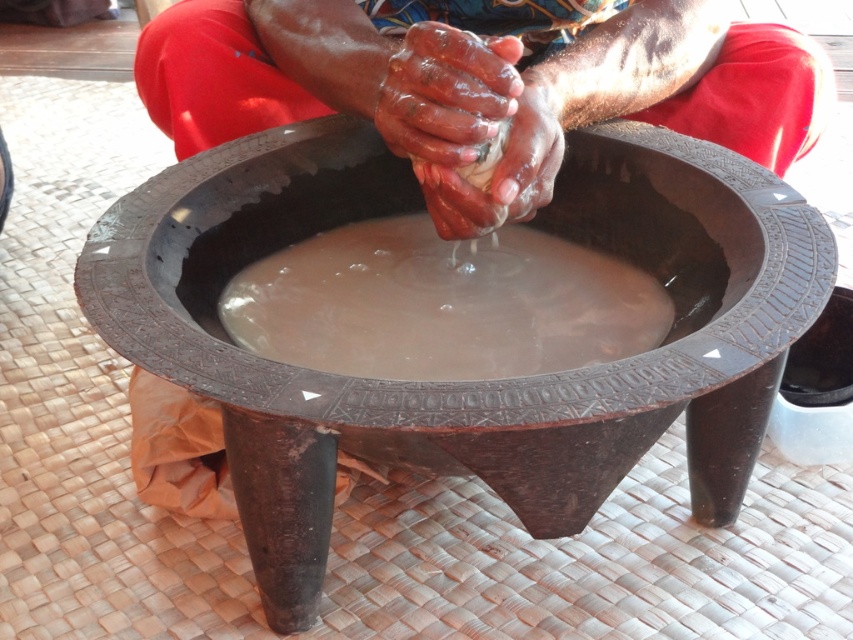
Who is taller, carved wooden bowl at center or smooth clay hands at center?

With more height is carved wooden bowl at center.

Looking at this image, is carved wooden bowl at center taller than smooth clay hands at center?

Yes, carved wooden bowl at center is taller than smooth clay hands at center.

What do you see at coordinates (473, 381) in the screenshot? I see `carved wooden bowl at center` at bounding box center [473, 381].

Where is `carved wooden bowl at center`? This screenshot has width=853, height=640. carved wooden bowl at center is located at coordinates (473, 381).

Does smooth clay hands at center appear on the right side of smooth clay mud at center?

Correct, you'll find smooth clay hands at center to the right of smooth clay mud at center.

Is smooth clay hands at center above smooth clay mud at center?

Indeed, smooth clay hands at center is positioned over smooth clay mud at center.

Locate an element on the screen. The width and height of the screenshot is (853, 640). smooth clay hands at center is located at coordinates (479, 84).

Find the location of `smooth clay hands at center`. smooth clay hands at center is located at coordinates (479, 84).

Does carved wooden bowl at center appear on the left side of smooth clay mud at center?

No, carved wooden bowl at center is not to the left of smooth clay mud at center.

Does carved wooden bowl at center have a lesser height compared to smooth clay mud at center?

No, carved wooden bowl at center is not shorter than smooth clay mud at center.

Who is more forward, (x=766, y=316) or (x=569, y=364)?

Positioned in front is point (x=766, y=316).

The height and width of the screenshot is (640, 853). I want to click on carved wooden bowl at center, so click(x=473, y=381).